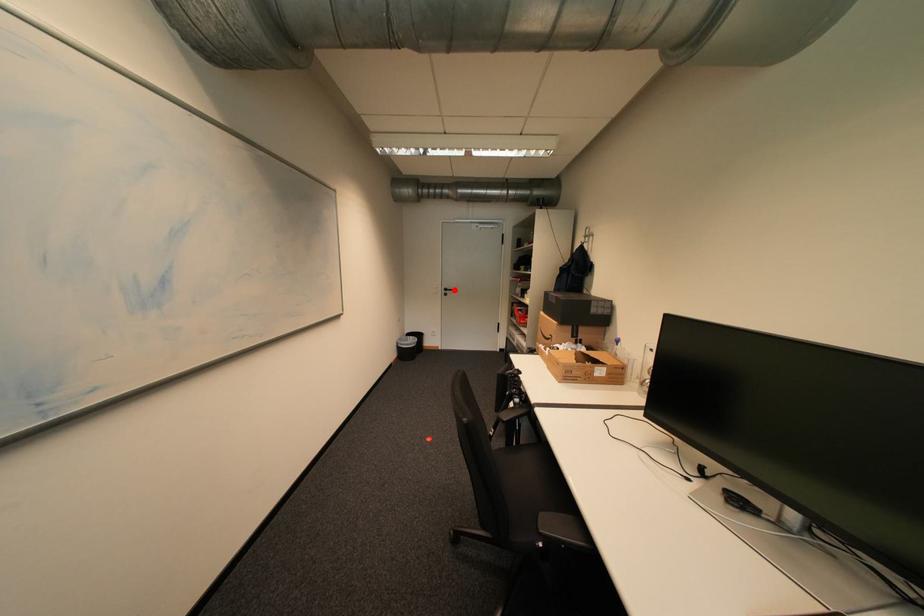
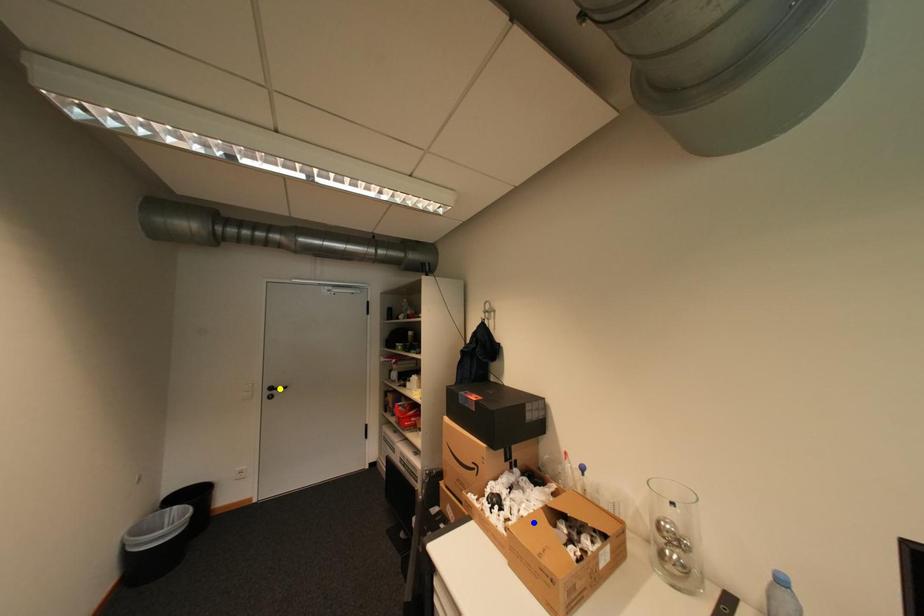
Question: I am providing you with two images of the same scene from different viewpoints. A red point is marked on the first image. You are given multiple points on the second image. Which mark in image 2 goes with the point in image 1?

Choices:
 (A) green point
 (B) yellow point
 (C) blue point

Answer: (B)